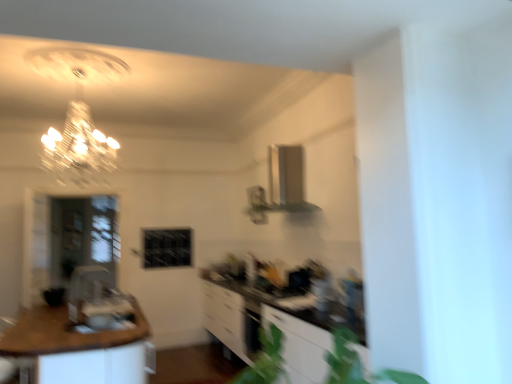
Question: From the image's perspective, is transparent glass door at left below white glossy cabinetry at center?

Choices:
 (A) no
 (B) yes

Answer: (A)

Question: Considering the relative sizes of transparent glass door at left and white glossy cabinetry at center in the image provided, is transparent glass door at left wider than white glossy cabinetry at center?

Choices:
 (A) yes
 (B) no

Answer: (B)

Question: Is transparent glass door at left shorter than white glossy cabinetry at center?

Choices:
 (A) no
 (B) yes

Answer: (A)

Question: From a real-world perspective, is transparent glass door at left positioned under white glossy cabinetry at center based on gravity?

Choices:
 (A) no
 (B) yes

Answer: (A)

Question: Is transparent glass door at left not near white glossy cabinetry at center?

Choices:
 (A) no
 (B) yes

Answer: (B)

Question: From the image's perspective, is transparent glass door at left on white glossy cabinetry at center?

Choices:
 (A) yes
 (B) no

Answer: (A)

Question: From the image's perspective, is transparent glass door at left located beneath brown wood countertop at lower left?

Choices:
 (A) no
 (B) yes

Answer: (A)

Question: Considering the relative sizes of transparent glass door at left and brown wood countertop at lower left in the image provided, is transparent glass door at left smaller than brown wood countertop at lower left?

Choices:
 (A) no
 (B) yes

Answer: (B)

Question: Is transparent glass door at left to the right of brown wood countertop at lower left from the viewer's perspective?

Choices:
 (A) no
 (B) yes

Answer: (A)

Question: Is transparent glass door at left next to brown wood countertop at lower left and touching it?

Choices:
 (A) yes
 (B) no

Answer: (B)

Question: Is transparent glass door at left facing towards brown wood countertop at lower left?

Choices:
 (A) no
 (B) yes

Answer: (B)

Question: From a real-world perspective, is transparent glass door at left below brown wood countertop at lower left?

Choices:
 (A) no
 (B) yes

Answer: (A)

Question: Is brown wood countertop at lower left oriented away from transparent glass door at left?

Choices:
 (A) yes
 (B) no

Answer: (B)